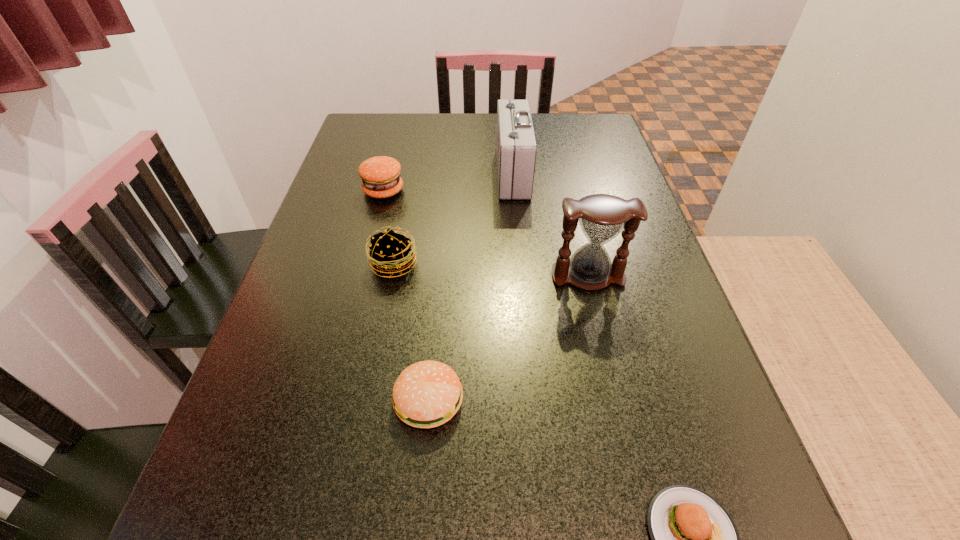
At what (x,y) coordinates should I click in order to perform the action: click on hourglass. Please return your answer as a coordinate pair (x, y). Image resolution: width=960 pixels, height=540 pixels. Looking at the image, I should click on (602, 217).

Where is `the fourth object from left to right`? the fourth object from left to right is located at coordinates (516, 148).

Find the location of a particular element. This screenshot has width=960, height=540. the second farthest food is located at coordinates (391, 253).

Where is `the farthest food`? Image resolution: width=960 pixels, height=540 pixels. the farthest food is located at coordinates (380, 175).

This screenshot has height=540, width=960. Identify the location of the second shortest food. (427, 394).

I want to click on the fifth farthest object, so click(427, 394).

Where is `free space located 0.310m on the front of the hourglass`? free space located 0.310m on the front of the hourglass is located at coordinates point(628,445).

You are a GUI agent. You are given a task and a screenshot of the screen. Output one action in this format:
    pyautogui.click(x=<x>, y=<y>)
    Task: Click on the free point located 0.180m on the front-facing side of the fourth object from left to right
    The height and width of the screenshot is (540, 960).
    Given the screenshot: What is the action you would take?
    pyautogui.click(x=430, y=174)

Identify the location of blank space located 0.300m on the front-facing side of the fourth object from left to right. This screenshot has height=540, width=960. (385, 174).

Image resolution: width=960 pixels, height=540 pixels. What are the coordinates of `vacant area located 0.060m on the front-facing side of the fourth object from left to right` in the screenshot? It's located at (x=475, y=174).